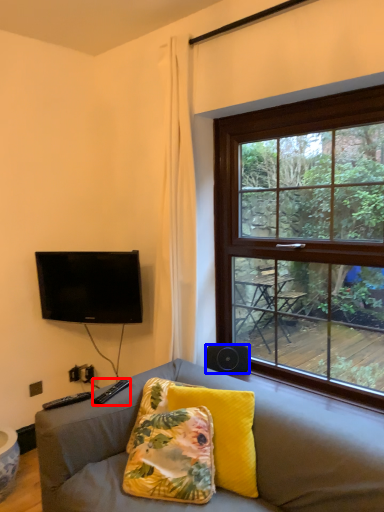
Question: Which object appears closest to the camera in this image, remote (highlighted by a red box) or loudspeaker (highlighted by a blue box)?

Choices:
 (A) remote
 (B) loudspeaker

Answer: (A)